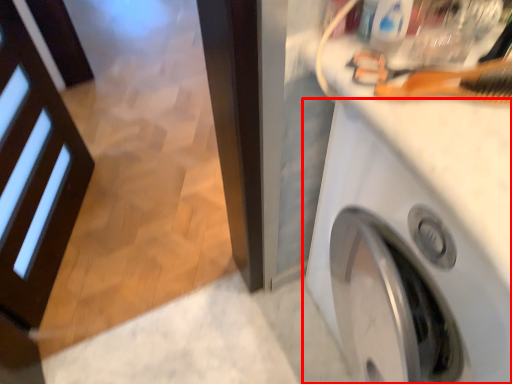
Question: From the image's perspective, what is the correct spatial positioning of washing machine (annotated by the red box) in reference to brush?

Choices:
 (A) above
 (B) below

Answer: (B)